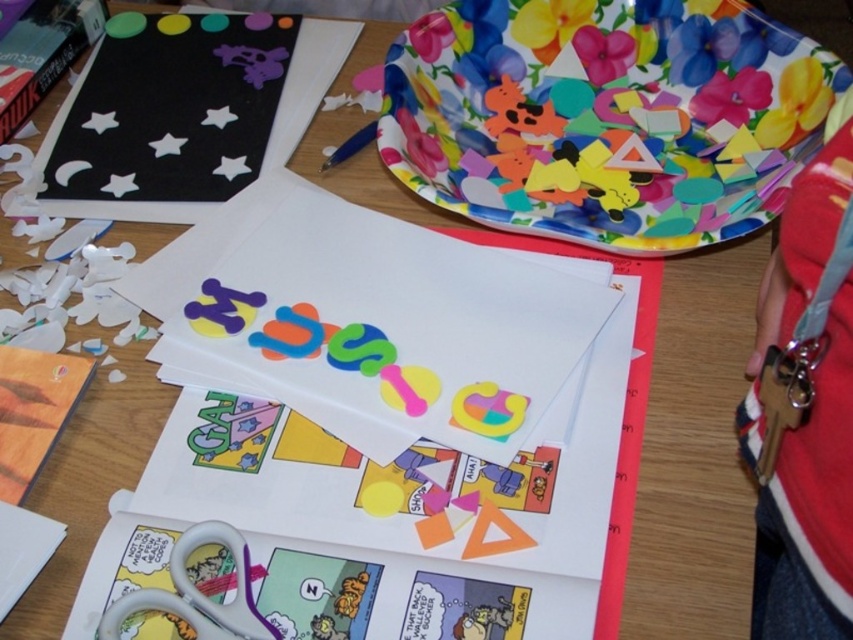
Question: Among these points, which one is farthest from the camera?

Choices:
 (A) (167, 611)
 (B) (279, 209)

Answer: (B)

Question: Which point appears farthest from the camera in this image?

Choices:
 (A) (206, 525)
 (B) (444, 172)

Answer: (B)

Question: Is matte paper at center positioned in front of white plastic scissors at lower left?

Choices:
 (A) no
 (B) yes

Answer: (A)

Question: Among these points, which one is farthest from the camera?

Choices:
 (A) (537, 102)
 (B) (282, 257)

Answer: (A)

Question: Does floral paper plate at upper right appear over white plastic scissors at lower left?

Choices:
 (A) no
 (B) yes

Answer: (B)

Question: Observing the image, what is the correct spatial positioning of matte paper at center in reference to white plastic scissors at lower left?

Choices:
 (A) left
 (B) right

Answer: (B)